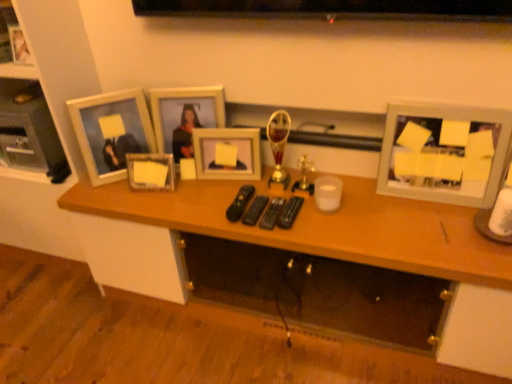
I want to click on vacant region to the right of black plastic remote control at center, placed as the fourth remote control when sorted from left to right, so (345, 211).